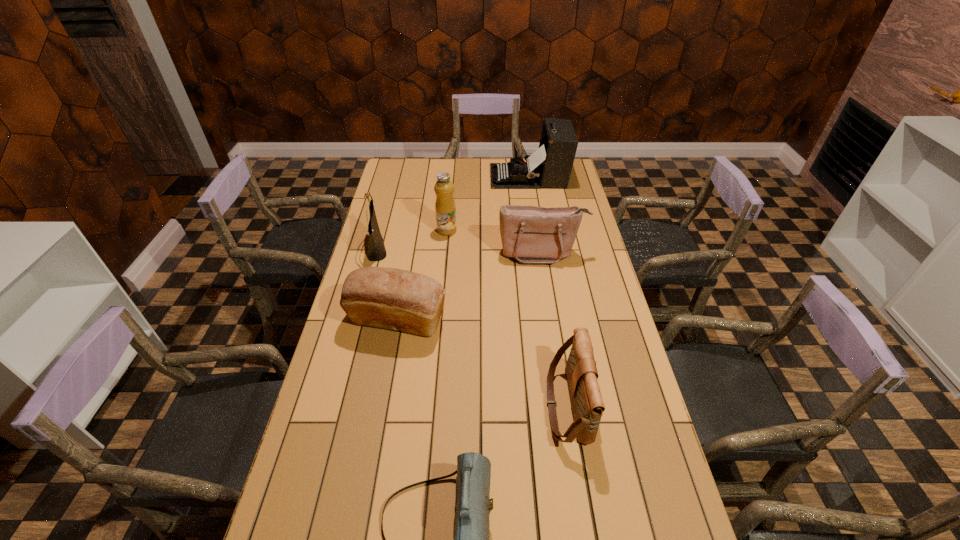
Where is `the farthest object`? Image resolution: width=960 pixels, height=540 pixels. the farthest object is located at coordinates (550, 166).

Image resolution: width=960 pixels, height=540 pixels. Find the location of `fruit juice`. fruit juice is located at coordinates (445, 207).

The image size is (960, 540). Find the location of `the leftmost shoulder bag`. the leftmost shoulder bag is located at coordinates pos(376,251).

Where is `the third nearest object`? the third nearest object is located at coordinates (389, 298).

Identify the location of the second nearest object. This screenshot has height=540, width=960. (587, 404).

You are a GUI agent. You are given a task and a screenshot of the screen. Output one action in this format:
    pyautogui.click(x=<x>, y=<y>)
    Task: Click on the vacant space located inside the open case of the typewriter
    Image resolution: width=960 pixels, height=540 pixels.
    Given the screenshot: What is the action you would take?
    pyautogui.click(x=473, y=177)

Locate an element on the screen. The image size is (960, 540). blank space located 0.280m inside the open case of the typewriter is located at coordinates (432, 177).

Locate an element on the screen. This screenshot has height=540, width=960. free location located 0.330m inside the open case of the typewriter is located at coordinates (421, 177).

This screenshot has width=960, height=540. I want to click on vacant region located on the front label of the fruit juice, so click(x=493, y=230).

Image resolution: width=960 pixels, height=540 pixels. What are the coordinates of `free space located 0.400m on the front of the leftmost shoulder bag` in the screenshot? It's located at (349, 354).